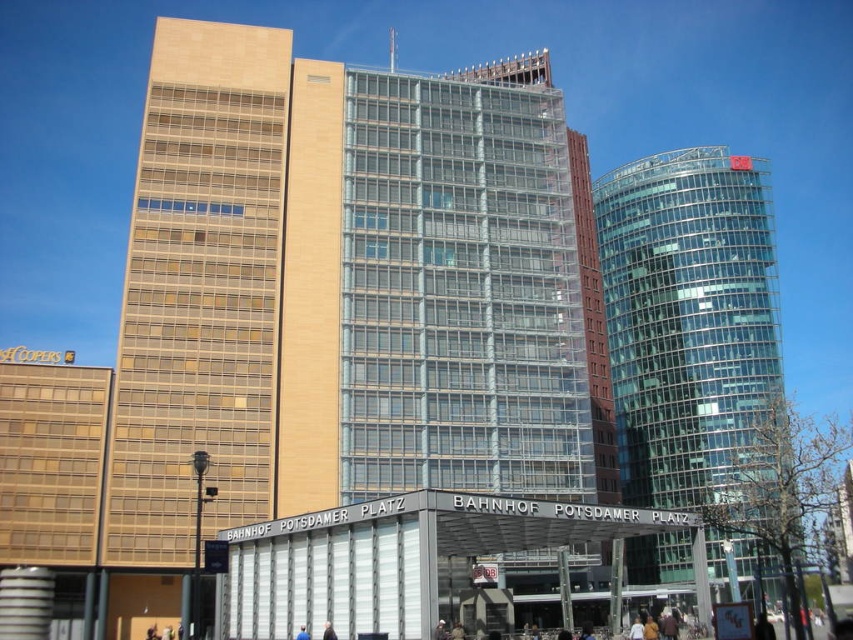
Question: Estimate the real-world distances between objects in this image. Which object is closer to the blue fabric person at lower center?

Choices:
 (A) transparent glass tower at right
 (B) dark blue fabric jacket at center

Answer: (B)

Question: Does dark blue fabric jacket at center come in front of blue fabric person at lower center?

Choices:
 (A) no
 (B) yes

Answer: (B)

Question: Which object appears closest to the camera in this image?

Choices:
 (A) dark blue fabric jacket at center
 (B) transparent glass tower at right
 (C) beige glass building at center
 (D) blue fabric person at lower center

Answer: (A)

Question: Which point is closer to the camera?

Choices:
 (A) (309, 636)
 (B) (334, 632)
 (C) (151, 211)

Answer: (B)

Question: Is beige glass building at center to the right of dark blue fabric jacket at center from the viewer's perspective?

Choices:
 (A) no
 (B) yes

Answer: (B)

Question: Can you confirm if beige glass building at center is bigger than blue fabric person at lower center?

Choices:
 (A) yes
 (B) no

Answer: (A)